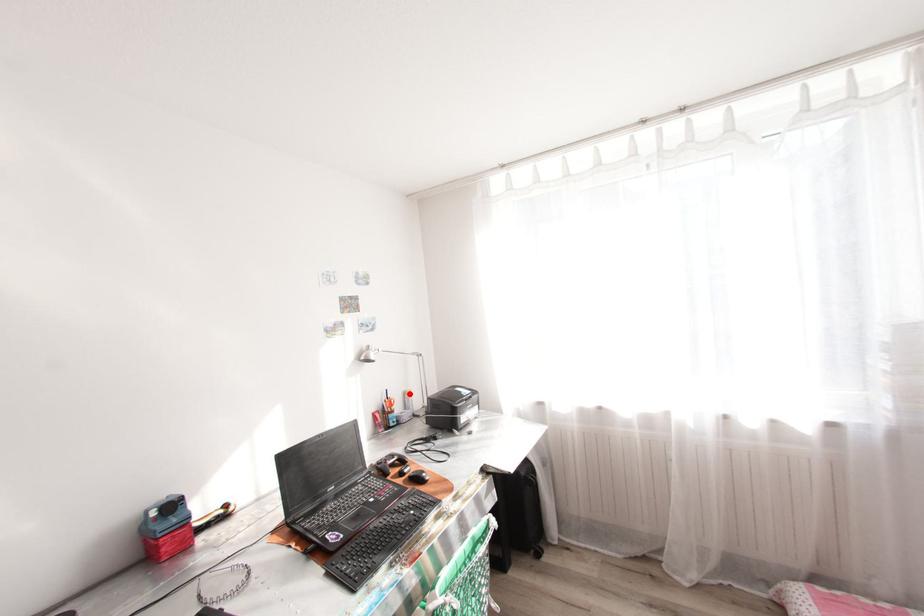
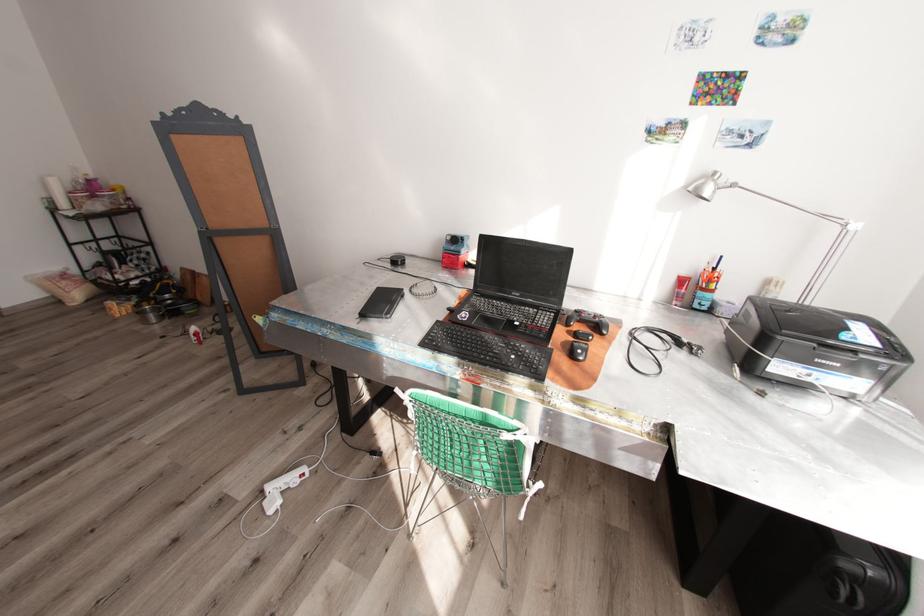
Where in the second image is the point corresponding to the highlighted location from the first image?

(772, 282)